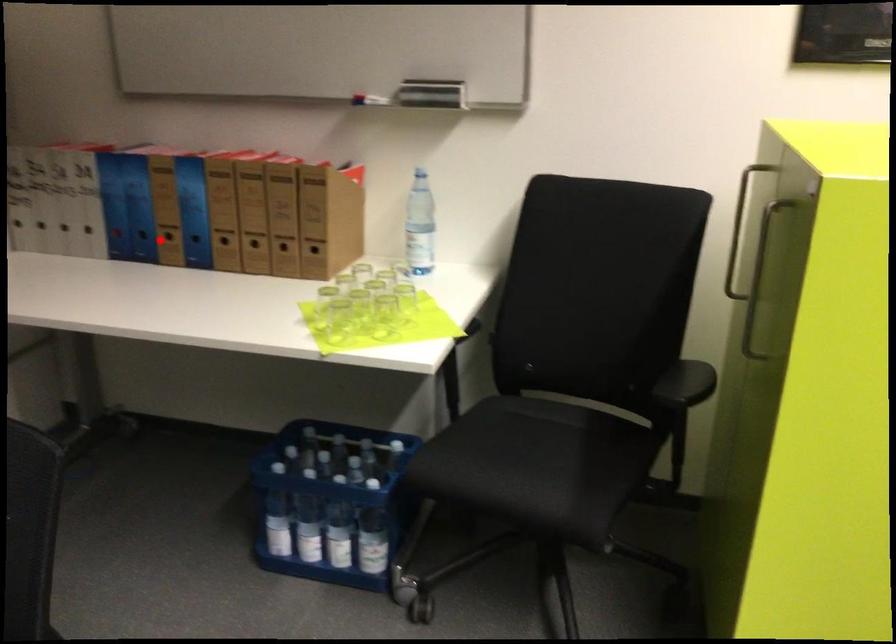
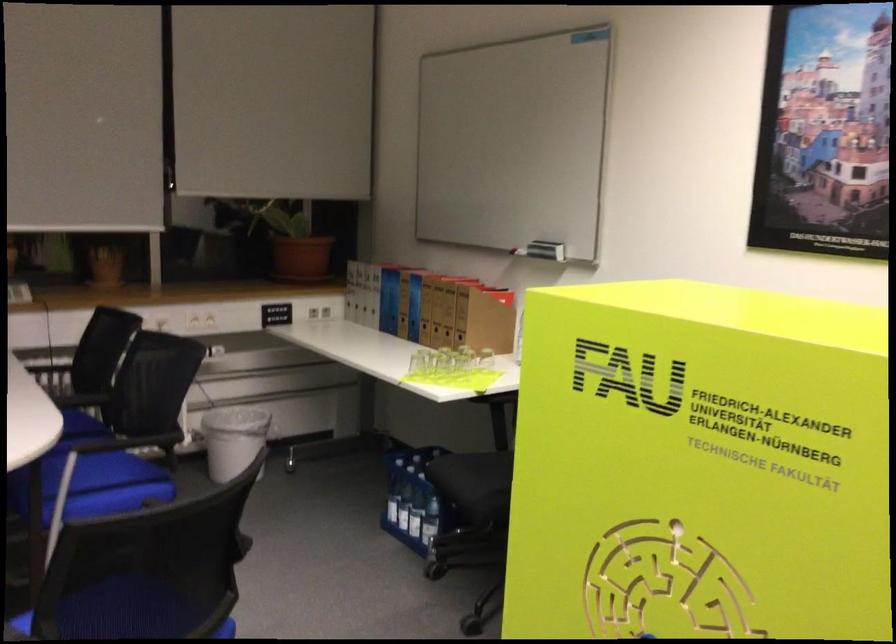
The point at the highlighted location is marked in the first image. Where is the corresponding point in the second image?

(398, 317)